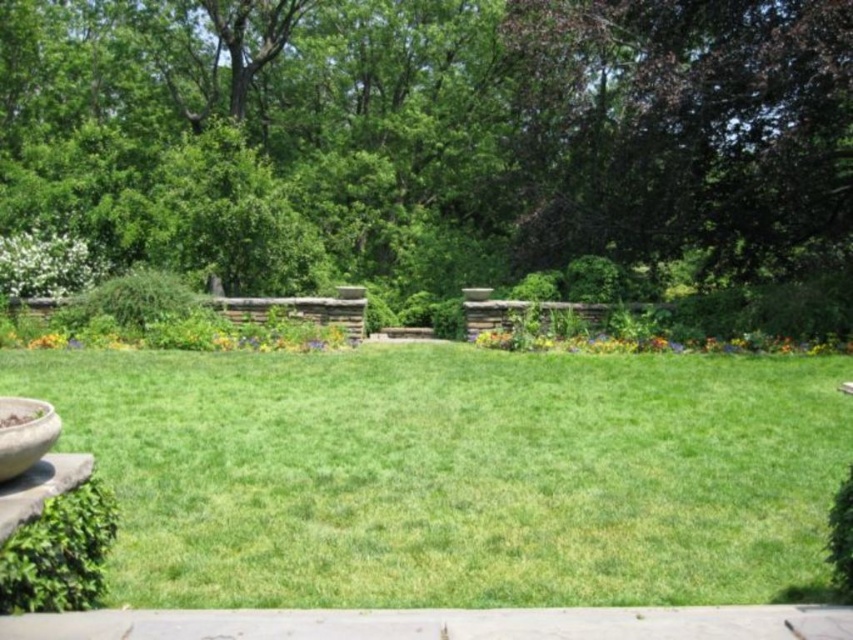
Question: Can you confirm if green grass at center is wider than matte concrete bowl at lower left?

Choices:
 (A) yes
 (B) no

Answer: (A)

Question: Which object is farther from the camera taking this photo?

Choices:
 (A) green leafy tree at center
 (B) matte concrete bowl at lower left

Answer: (A)

Question: Which point is farther to the camera?

Choices:
 (A) green leafy tree at center
 (B) matte concrete bowl at lower left

Answer: (A)

Question: Considering the relative positions of green leafy tree at center and green grass at center in the image provided, where is green leafy tree at center located with respect to green grass at center?

Choices:
 (A) below
 (B) above

Answer: (B)

Question: Which is nearer to the green grass at center?

Choices:
 (A) matte concrete bowl at lower left
 (B) green leafy tree at center

Answer: (A)

Question: Can you confirm if green leafy tree at center is positioned to the left of matte concrete bowl at lower left?

Choices:
 (A) no
 (B) yes

Answer: (A)